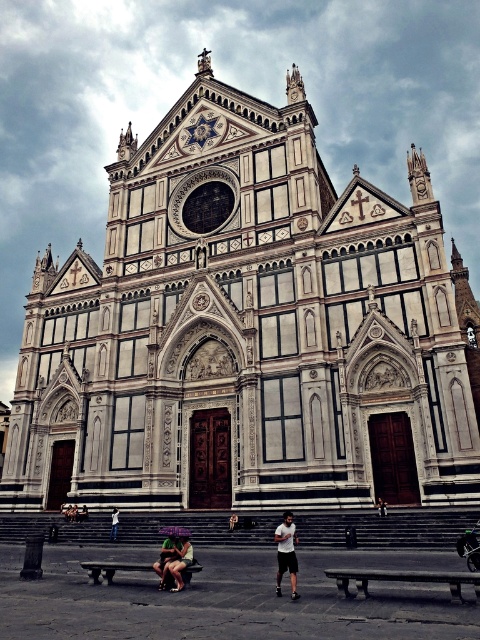
You are standing in front of the Santa Croce Church in Florence and notice the white marble church at center and the matte black shorts at lower center. Which object is located higher up in the image?

The white marble church at center is positioned over the matte black shorts at lower center, so it is higher up in the image.

You are standing in front of the Santa Croce Church in Florence. You notice a white marble church at center and a green fabric person at center. Which object is positioned higher in the scene?

A: The white marble church at center is located above the green fabric person at center, so it is positioned higher in the scene.